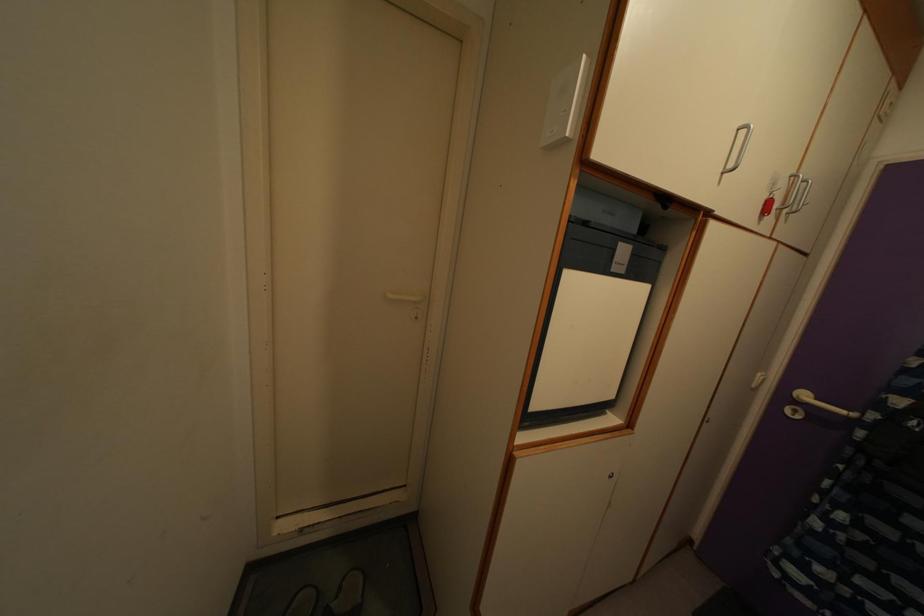
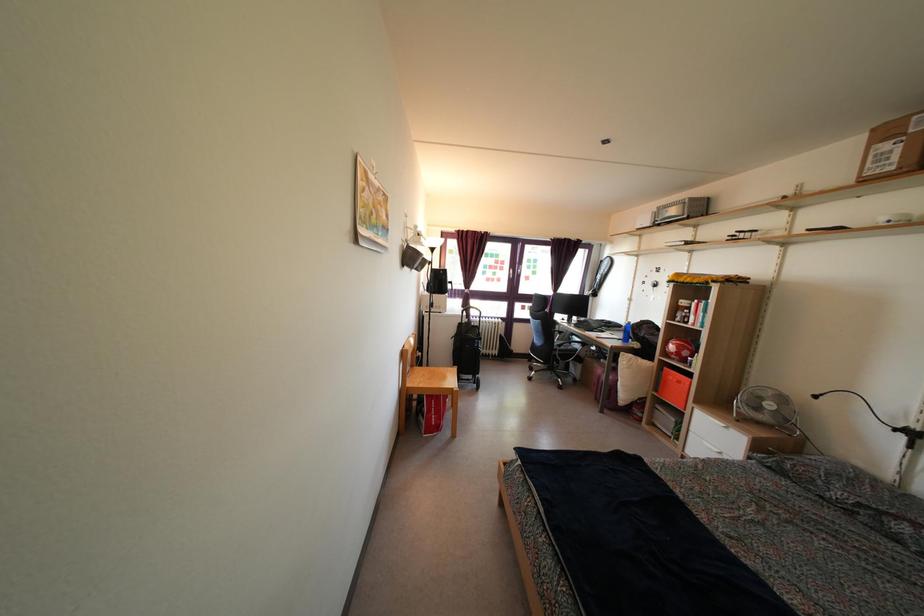
Question: How did the camera likely rotate?

Choices:
 (A) Left
 (B) Right
 (C) Up
 (D) Down

Answer: (A)